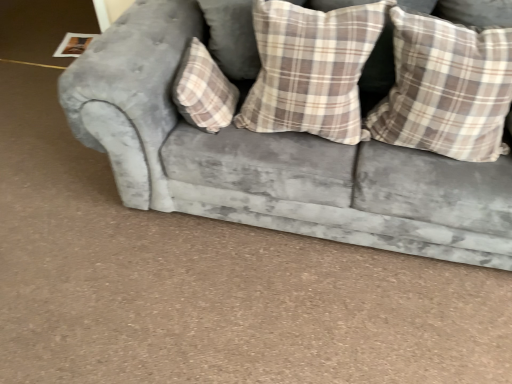
Question: Are plaid fabric pillow at center, positioned as the third pillow in right-to-left order, and plaid fabric pillow at center, arranged as the 2th pillow when viewed from the right, beside each other?

Choices:
 (A) yes
 (B) no

Answer: (B)

Question: From a real-world perspective, is plaid fabric pillow at center, positioned as the third pillow in right-to-left order, located higher than plaid fabric pillow at center, acting as the 2th pillow starting from the left?

Choices:
 (A) yes
 (B) no

Answer: (B)

Question: Does plaid fabric pillow at center, the 1th pillow positioned from the left, have a lesser height compared to plaid fabric pillow at center, acting as the 2th pillow starting from the left?

Choices:
 (A) yes
 (B) no

Answer: (A)

Question: Is the position of plaid fabric pillow at center, the 1th pillow positioned from the left, less distant than that of plaid fabric pillow at center, arranged as the 2th pillow when viewed from the right?

Choices:
 (A) yes
 (B) no

Answer: (B)

Question: Could plaid fabric pillow at center, acting as the 2th pillow starting from the left, be considered to be inside plaid fabric pillow at center, the 1th pillow positioned from the left?

Choices:
 (A) no
 (B) yes

Answer: (A)

Question: Is plaid fabric pillow at center, the 1th pillow positioned from the left, turned away from plaid fabric pillow at center, acting as the 2th pillow starting from the left?

Choices:
 (A) no
 (B) yes

Answer: (A)

Question: From the image's perspective, is velvet gray couch at center under plaid fabric pillow at right, positioned as the 1th pillow in right-to-left order?

Choices:
 (A) yes
 (B) no

Answer: (B)

Question: Considering the relative sizes of velvet gray couch at center and plaid fabric pillow at right, which appears as the 3th pillow when viewed from the left, in the image provided, is velvet gray couch at center wider than plaid fabric pillow at right, which appears as the 3th pillow when viewed from the left,?

Choices:
 (A) yes
 (B) no

Answer: (A)

Question: Does velvet gray couch at center lie behind plaid fabric pillow at right, which appears as the 3th pillow when viewed from the left?

Choices:
 (A) no
 (B) yes

Answer: (A)

Question: Is velvet gray couch at center facing towards plaid fabric pillow at right, which appears as the 3th pillow when viewed from the left?

Choices:
 (A) no
 (B) yes

Answer: (B)

Question: Can you confirm if velvet gray couch at center is positioned to the left of plaid fabric pillow at right, positioned as the 1th pillow in right-to-left order?

Choices:
 (A) yes
 (B) no

Answer: (A)

Question: Does velvet gray couch at center have a lesser width compared to plaid fabric pillow at right, positioned as the 1th pillow in right-to-left order?

Choices:
 (A) yes
 (B) no

Answer: (B)

Question: From a real-world perspective, is velvet gray couch at center physically below plaid fabric pillow at center, positioned as the third pillow in right-to-left order?

Choices:
 (A) yes
 (B) no

Answer: (A)